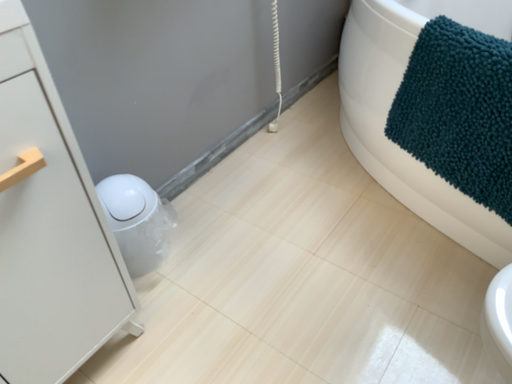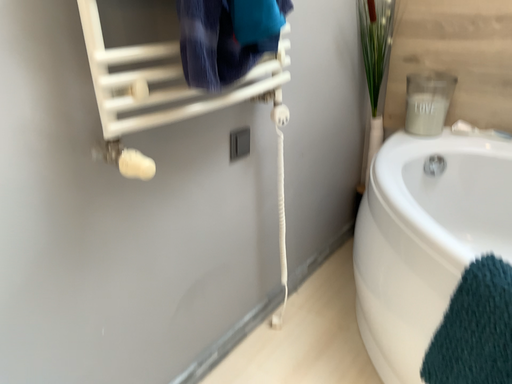
Question: Which way did the camera rotate in the video?

Choices:
 (A) rotated upward
 (B) rotated downward

Answer: (A)